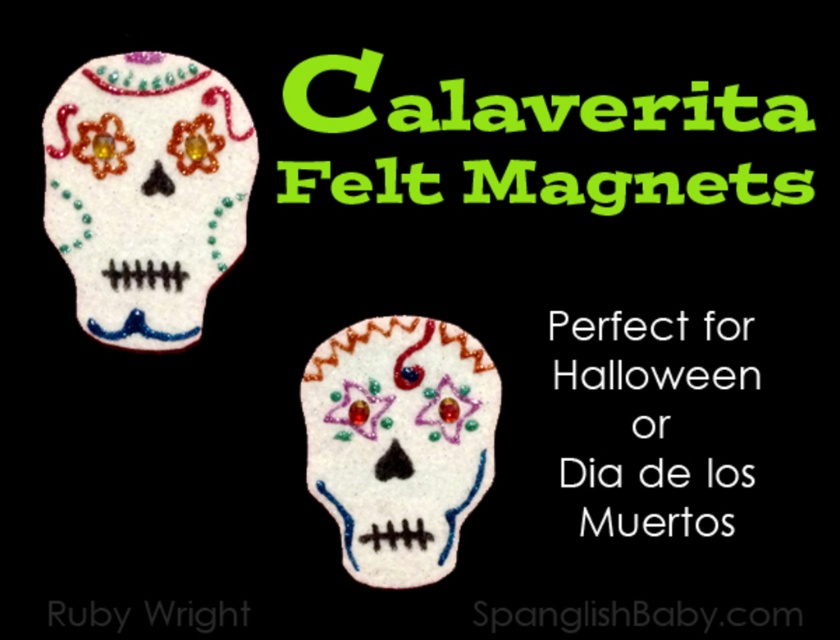
Question: Is white felt skull at upper left to the left of white felt skull at center from the viewer's perspective?

Choices:
 (A) no
 (B) yes

Answer: (B)

Question: Is white felt skull at upper left below white felt skull at center?

Choices:
 (A) no
 (B) yes

Answer: (A)

Question: Can you confirm if white felt skull at upper left is positioned below white felt skull at center?

Choices:
 (A) no
 (B) yes

Answer: (A)

Question: Which point is farther to the camera?

Choices:
 (A) (392, 333)
 (B) (95, 252)

Answer: (A)